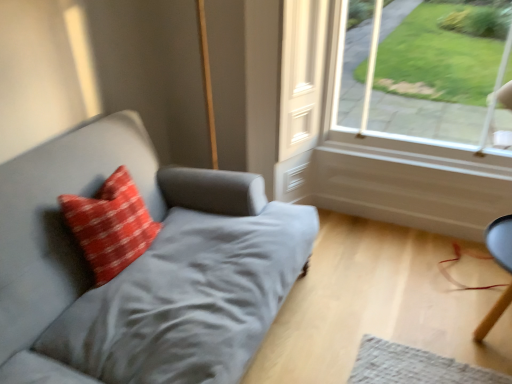
Question: Is suede gray couch at left turned away from smooth black chair at lower right?

Choices:
 (A) no
 (B) yes

Answer: (A)

Question: Is suede gray couch at left further to camera compared to smooth black chair at lower right?

Choices:
 (A) yes
 (B) no

Answer: (B)

Question: Is the position of suede gray couch at left less distant than that of smooth black chair at lower right?

Choices:
 (A) yes
 (B) no

Answer: (A)

Question: Is suede gray couch at left surrounding smooth black chair at lower right?

Choices:
 (A) yes
 (B) no

Answer: (B)

Question: Is suede gray couch at left to the right of smooth black chair at lower right from the viewer's perspective?

Choices:
 (A) yes
 (B) no

Answer: (B)

Question: Considering the relative sizes of suede gray couch at left and smooth black chair at lower right in the image provided, is suede gray couch at left smaller than smooth black chair at lower right?

Choices:
 (A) yes
 (B) no

Answer: (B)

Question: From the image's perspective, is clear glass window at upper right under smooth black chair at lower right?

Choices:
 (A) yes
 (B) no

Answer: (B)

Question: Is clear glass window at upper right outside smooth black chair at lower right?

Choices:
 (A) yes
 (B) no

Answer: (A)

Question: Is clear glass window at upper right next to smooth black chair at lower right?

Choices:
 (A) no
 (B) yes

Answer: (A)

Question: From a real-world perspective, is clear glass window at upper right located higher than smooth black chair at lower right?

Choices:
 (A) no
 (B) yes

Answer: (B)

Question: Is clear glass window at upper right thinner than smooth black chair at lower right?

Choices:
 (A) no
 (B) yes

Answer: (B)

Question: Does clear glass window at upper right appear on the left side of smooth black chair at lower right?

Choices:
 (A) yes
 (B) no

Answer: (A)

Question: Is red textured pillow at left at the left side of suede gray couch at left?

Choices:
 (A) yes
 (B) no

Answer: (A)